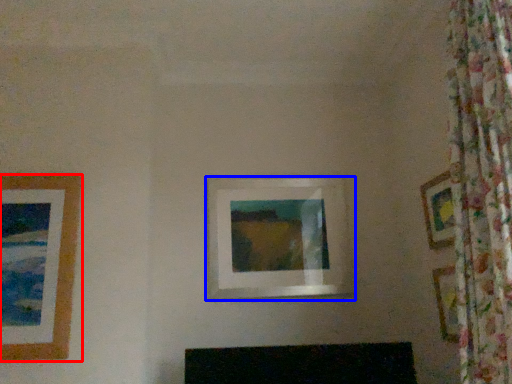
Question: Which object appears closest to the camera in this image, picture frame (highlighted by a red box) or picture frame (highlighted by a blue box)?

Choices:
 (A) picture frame
 (B) picture frame

Answer: (A)